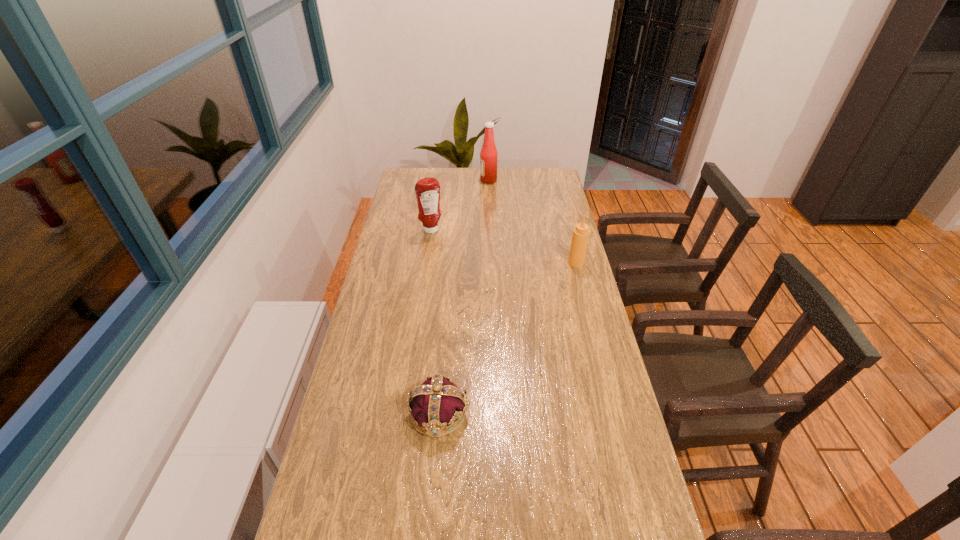
Image resolution: width=960 pixels, height=540 pixels. Find the location of `free space located on the front-facing side of the tallest object`. free space located on the front-facing side of the tallest object is located at coordinates (466, 180).

Where is `vacant space situated 0.080m on the back of the third nearest object`? The image size is (960, 540). vacant space situated 0.080m on the back of the third nearest object is located at coordinates (434, 214).

Where is `vacant region located on the left of the rightmost condiment`? vacant region located on the left of the rightmost condiment is located at coordinates (504, 263).

Locate an element on the screen. This screenshot has height=540, width=960. vacant space situated on the right of the shortest object is located at coordinates (601, 413).

What are the coordinates of `object at the far edge` in the screenshot? It's located at (488, 155).

Find the location of a particular element. The height and width of the screenshot is (540, 960). object that is positioned at the left edge is located at coordinates (x=427, y=190).

This screenshot has width=960, height=540. Identify the location of object present at the right edge. (580, 237).

Where is `blank area at the far edge`? The image size is (960, 540). blank area at the far edge is located at coordinates (516, 190).

In the image, there is a desktop. Where is `vacant space at the left edge`? This screenshot has height=540, width=960. vacant space at the left edge is located at coordinates (387, 315).

The image size is (960, 540). Identify the location of vacant space at the right edge of the desktop. tap(559, 347).